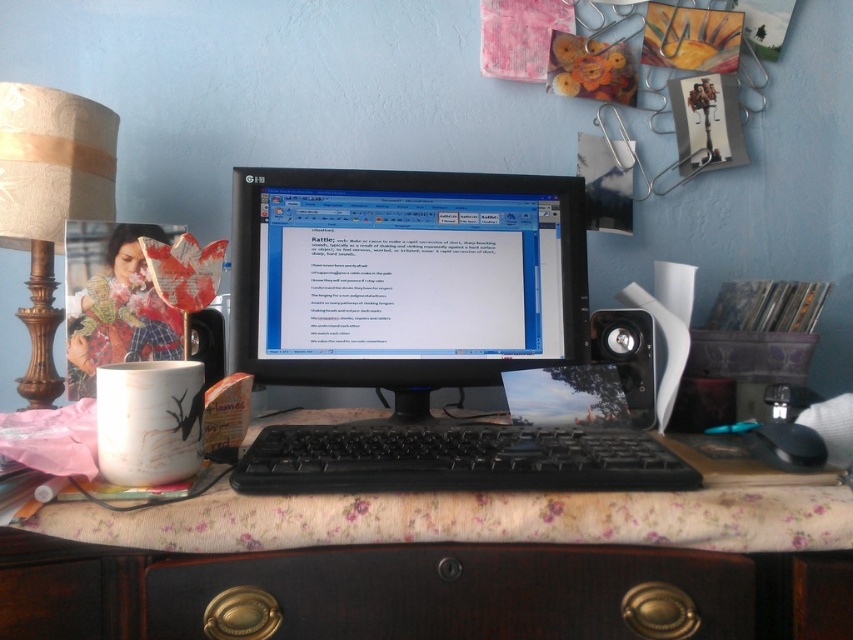
Who is more forward, (74,157) or (152,452)?

Point (152,452)

Can you confirm if beige fabric lampshade at left is smaller than white matte mug at center?

No, beige fabric lampshade at left is not smaller than white matte mug at center.

The height and width of the screenshot is (640, 853). Find the location of `beige fabric lampshade at left`. beige fabric lampshade at left is located at coordinates (49, 202).

In the scene shown: Is the position of dark wood drawer at lower center less distant than that of black plastic mouse at lower right?

That is True.

Is point (444, 605) positioned after point (808, 442)?

No, it is in front of (808, 442).

Where is `dark wood drawer at lower center`? The width and height of the screenshot is (853, 640). dark wood drawer at lower center is located at coordinates (456, 593).

Which of these two, black matte monitor at center or floral fabric computer desk at center, stands taller?

Standing taller between the two is black matte monitor at center.

Does black matte monitor at center appear on the right side of floral fabric computer desk at center?

Indeed, black matte monitor at center is positioned on the right side of floral fabric computer desk at center.

Which is in front, point (523, 262) or point (285, 573)?

Point (285, 573)

You are a GUI agent. You are given a task and a screenshot of the screen. Output one action in this format:
    pyautogui.click(x=<x>, y=<y>)
    Task: Click on the black matte monitor at center
    This screenshot has width=853, height=640.
    Given the screenshot: What is the action you would take?
    pyautogui.click(x=418, y=326)